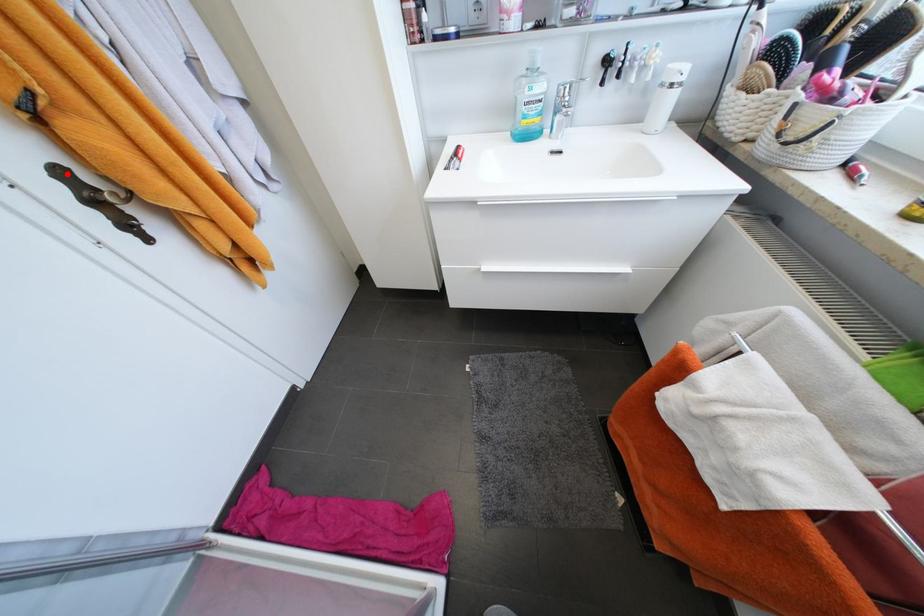
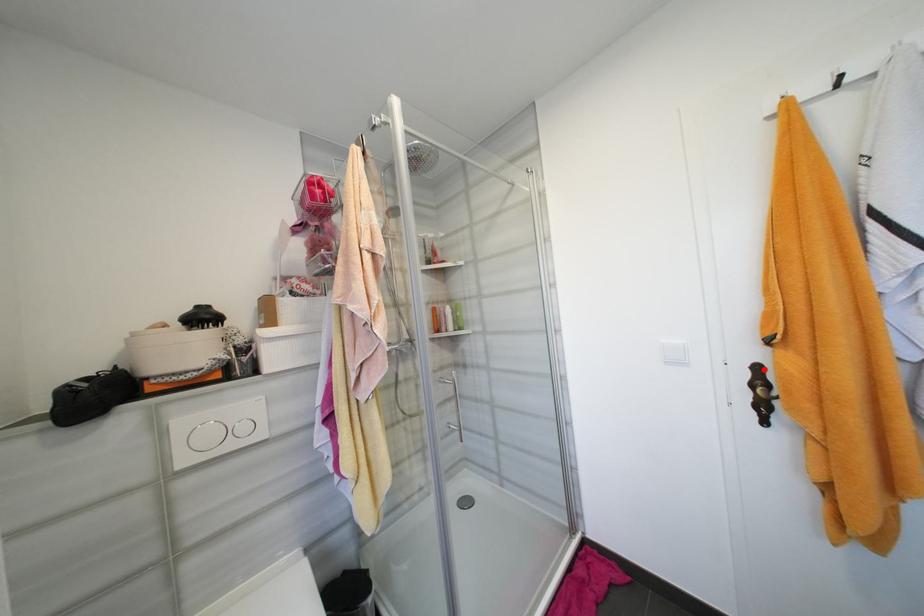
I am providing you with two images of the same scene from different viewpoints. A red point is marked on the first image and another point is marked on the second image. Do the highlighted points in image1 and image2 indicate the same real-world spot?

Yes